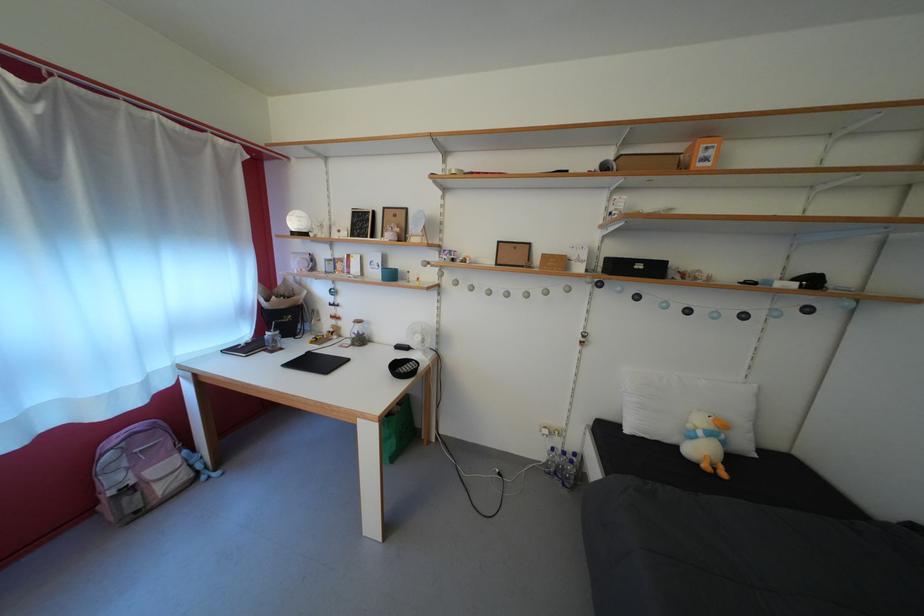
Find the location of a particular element. The image size is (924, 616). blue cylindrical cup is located at coordinates (388, 274).